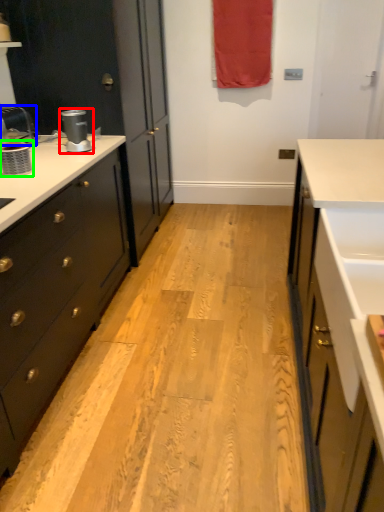
Question: Which object is positioned closest to coffee machine (highlighted by a red box)? Select from faucet (highlighted by a blue box) and appliance (highlighted by a green box).

Choices:
 (A) faucet
 (B) appliance

Answer: (A)